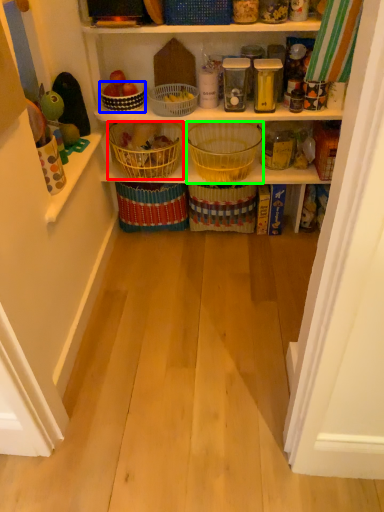
Question: Which object is positioned farthest from basket (highlighted by a red box)? Select from basket (highlighted by a blue box) and basket (highlighted by a green box).

Choices:
 (A) basket
 (B) basket

Answer: (B)